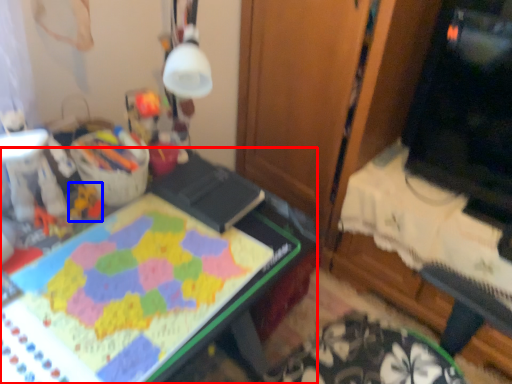
Question: Among these objects, which one is nearest to the camera, desk (highlighted by a red box) or toy (highlighted by a blue box)?

Choices:
 (A) desk
 (B) toy

Answer: (A)